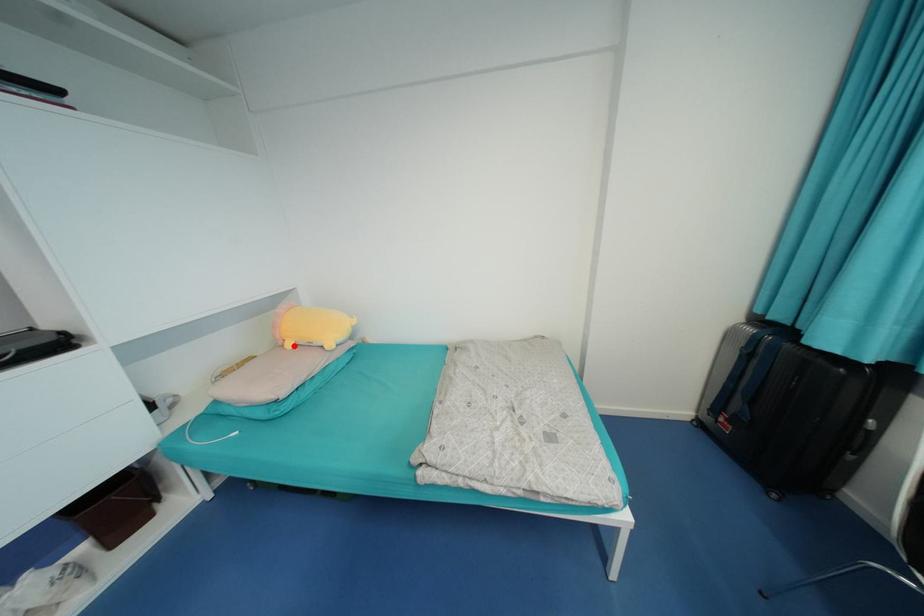
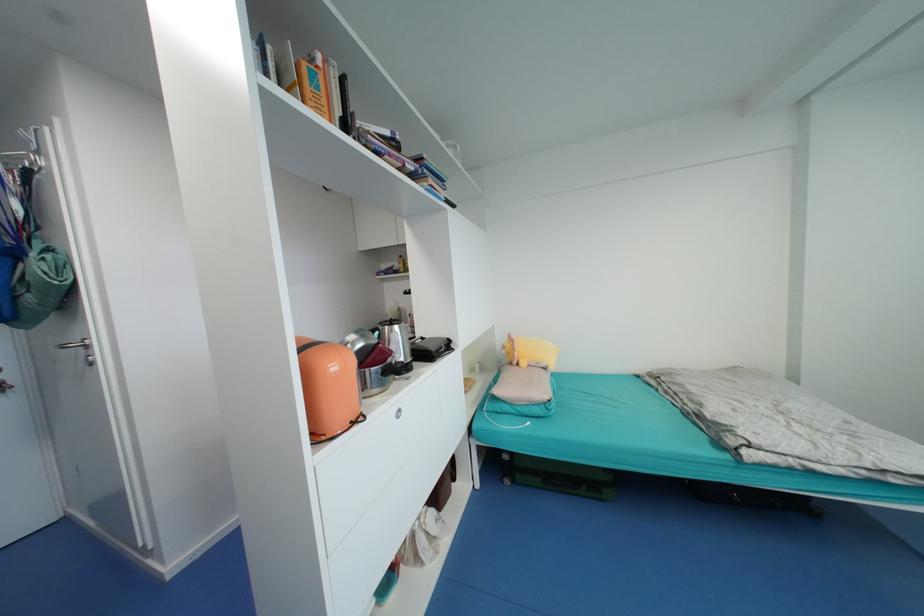
Question: A red point is marked in image1. In image2, is the corresponding 3D point closer to the camera or farther? Reply with the corresponding letter.

Choices:
 (A) The corresponding 3D point is closer.
 (B) The corresponding 3D point is farther.

Answer: (B)